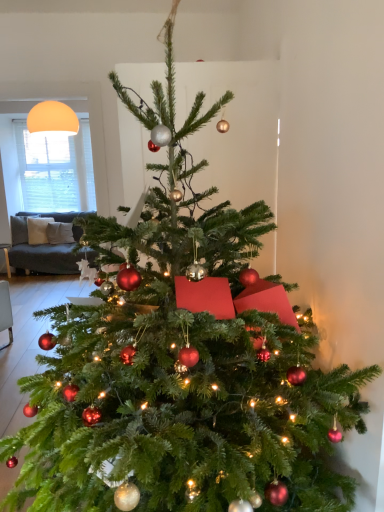
Question: In the image, is matte orange sphere at upper left positioned in front of or behind white matte window screen at upper left?

Choices:
 (A) front
 (B) behind

Answer: (A)

Question: Based on their positions, is matte orange sphere at upper left located to the left or right of white matte window screen at upper left?

Choices:
 (A) left
 (B) right

Answer: (B)

Question: Is matte orange sphere at upper left bigger or smaller than white matte window screen at upper left?

Choices:
 (A) small
 (B) big

Answer: (A)

Question: Considering the positions of white matte window screen at upper left and matte orange sphere at upper left in the image, is white matte window screen at upper left bigger or smaller than matte orange sphere at upper left?

Choices:
 (A) big
 (B) small

Answer: (A)

Question: Is white matte window screen at upper left in front of or behind matte orange sphere at upper left in the image?

Choices:
 (A) behind
 (B) front

Answer: (A)

Question: Visually, is white matte window screen at upper left positioned to the left or to the right of matte orange sphere at upper left?

Choices:
 (A) left
 (B) right

Answer: (A)

Question: From a real-world perspective, is white matte window screen at upper left positioned above or below matte orange sphere at upper left?

Choices:
 (A) below
 (B) above

Answer: (A)